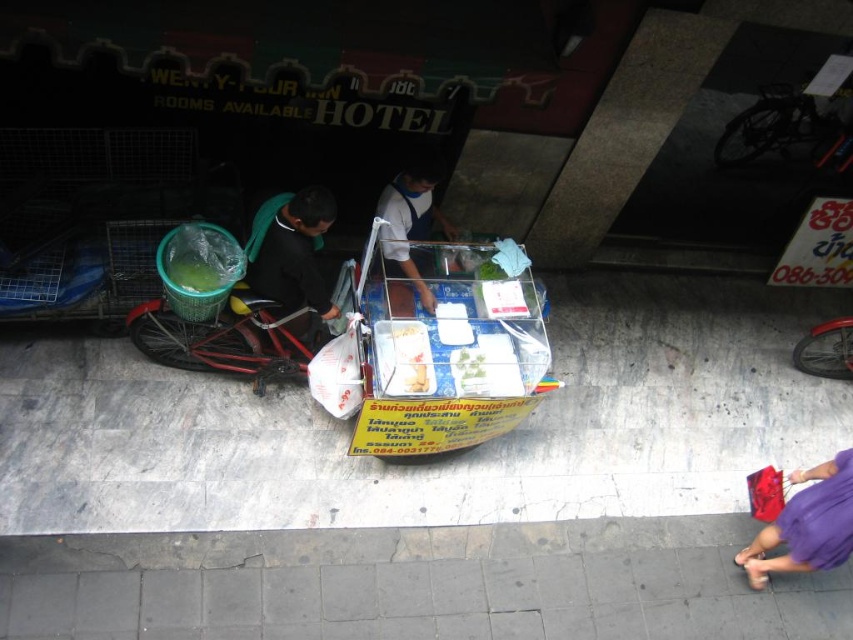
Question: Is gray concrete pavement at lower center in front of purple fabric bag at lower right?

Choices:
 (A) no
 (B) yes

Answer: (B)

Question: Where is smooth concrete pavement at center located in relation to white glossy shirt at center in the image?

Choices:
 (A) above
 (B) below

Answer: (B)

Question: Which object is farther from the camera taking this photo?

Choices:
 (A) gray concrete pavement at lower center
 (B) dark green fabric bag at left

Answer: (A)

Question: Which point appears closest to the camera in this image?

Choices:
 (A) (724, 444)
 (B) (296, 273)

Answer: (B)

Question: Which object is farther from the camera taking this photo?

Choices:
 (A) purple fabric bag at lower right
 (B) smooth concrete pavement at center
 (C) white glossy shirt at center
 (D) gray concrete pavement at lower center

Answer: (B)

Question: Is smooth concrete pavement at center to the right of purple fabric bag at lower right from the viewer's perspective?

Choices:
 (A) no
 (B) yes

Answer: (A)